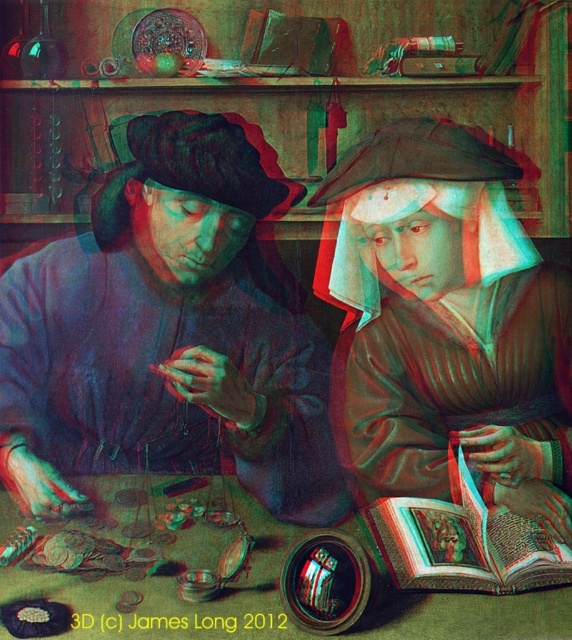
In the artwork by James Long from 2012, there is a matte brown robe at center and a wooden table at center. Which object is wider?

The wooden table at center is wider than the matte brown robe at center.